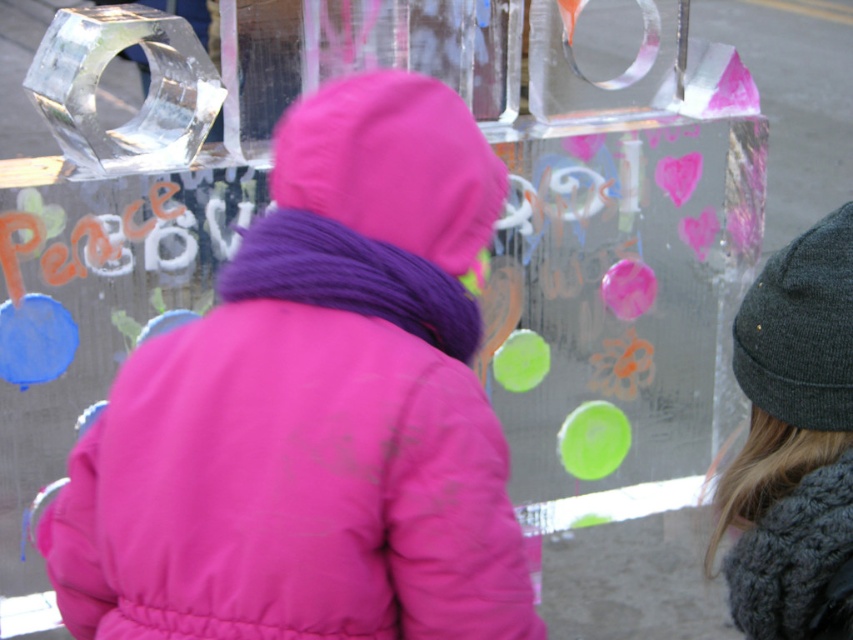
You are a photographer standing in front of the ice sculpture. You want to take a photo of the pink matte jacket at center and the knitted gray beanie at right. Which object will appear larger in the photo?

The pink matte jacket at center will appear larger in the photo because it is closer to the photographer than the knitted gray beanie at right.

You are an artist who wants to paint a mural of the scene. You need to know which object is wider to scale them correctly. Which is wider, the pink matte jacket at center or the knitted gray beanie at right?

The pink matte jacket at center is wider than the knitted gray beanie at right according to the description.

You are standing in front of the ice sculpture and want to touch the pink matte jacket at center. Which direction should you move relative to the point at coordinates point (314,410)?

The point at coordinates point (314,410) is on the pink matte jacket at center, so you should move towards the point at coordinates point (314,410) to touch the pink matte jacket at center.